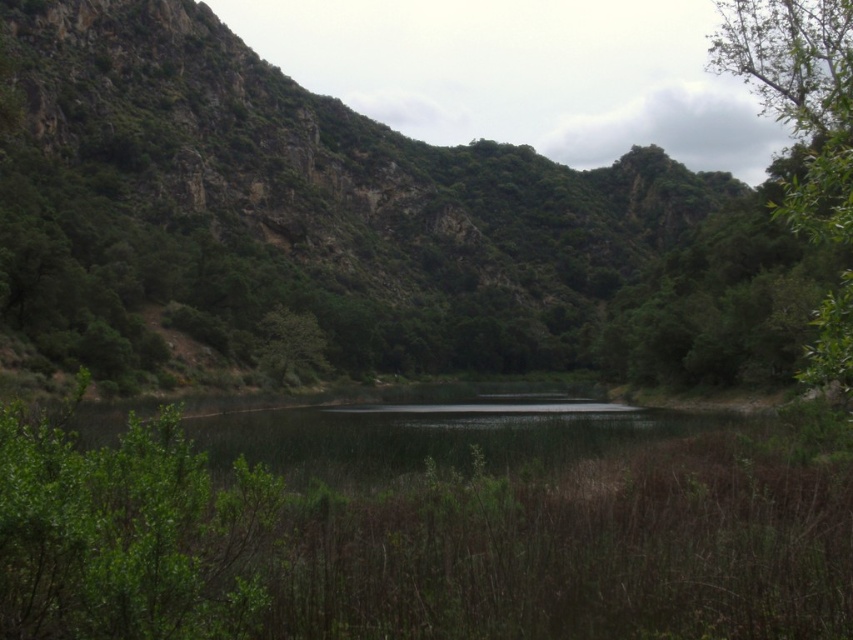
You are standing at the point with coordinates point [291,368] in the scene. You want to walk towards the point with coordinates point [727,3]. Which direction should you move relative to your current position?

To reach point [727,3] from point [291,368], you should move towards the upper left direction since point [727,3] is behind point [291,368].

You are standing at the edge of the lake in this serene landscape and notice two points marked in the image. The first point is at coordinates point (88, 572) and the second is at point (827, 161). Which of these two points is nearer to your current position?

Point (88, 572) is closer to the camera than point (827, 161), so the first point is nearer to your current position.